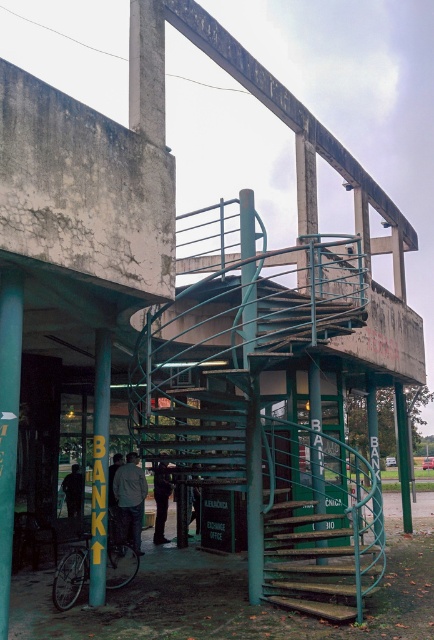
Is yellow painted metal pole at lower left thinner than dark gray pants at center?

Yes.

Does point (108, 332) come farther from viewer compared to point (154, 492)?

That is False.

Which is in front, point (95, 340) or point (161, 499)?

Point (95, 340) is more forward.

What are the coordinates of `yellow painted metal pole at lower left` in the screenshot? It's located at (99, 468).

Between wooden stairs at center and dark gray jacket at center, which one appears on the left side from the viewer's perspective?

From the viewer's perspective, dark gray jacket at center appears more on the left side.

Which is below, wooden stairs at center or dark gray jacket at center?

dark gray jacket at center is lower down.

Which is behind, point (282, 600) or point (132, 467)?

Point (132, 467)

At what (x,y) coordinates should I click in order to perform the action: click on wooden stairs at center. Please return your answer as a coordinate pair (x, y). Image resolution: width=434 pixels, height=640 pixels. Looking at the image, I should click on (316, 560).

Does wooden stairs at center appear over yellow painted metal pole at lower left?

No.

Is wooden stairs at center further to the viewer compared to yellow painted metal pole at lower left?

No.

This screenshot has width=434, height=640. Find the location of `wooden stairs at center`. wooden stairs at center is located at coordinates (316, 560).

The image size is (434, 640). I want to click on wooden stairs at center, so click(x=316, y=560).